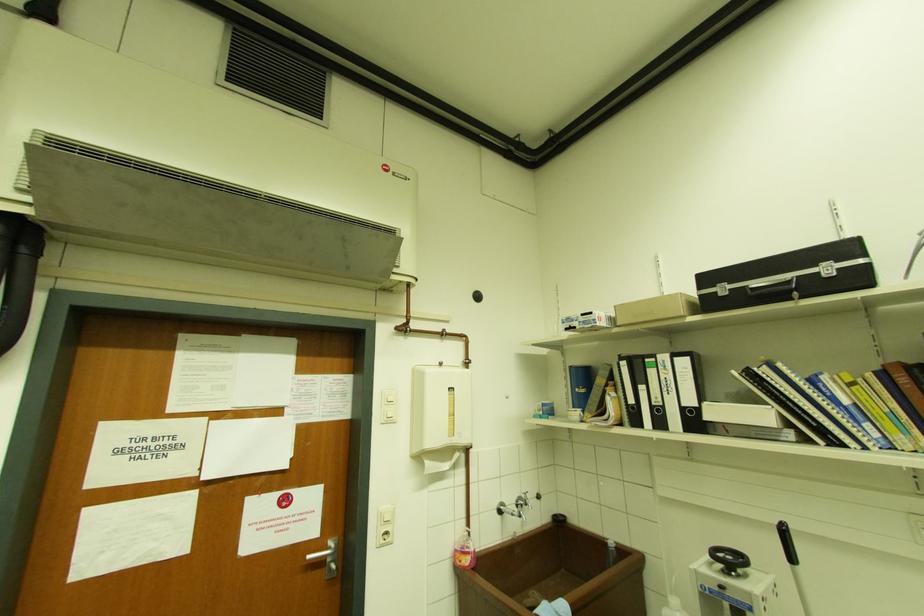
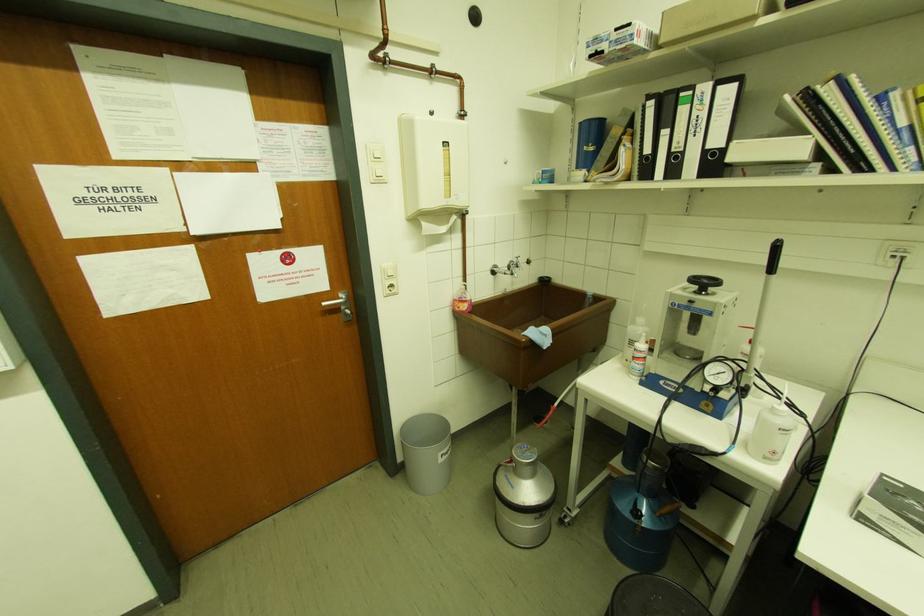
Locate, in the second image, the point that corresponds to [311,559] in the first image.

(326, 305)